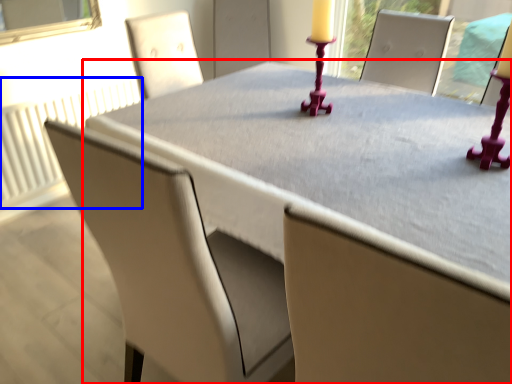
Question: Which point is further to the camera, table (highlighted by a red box) or radiator (highlighted by a blue box)?

Choices:
 (A) table
 (B) radiator

Answer: (B)